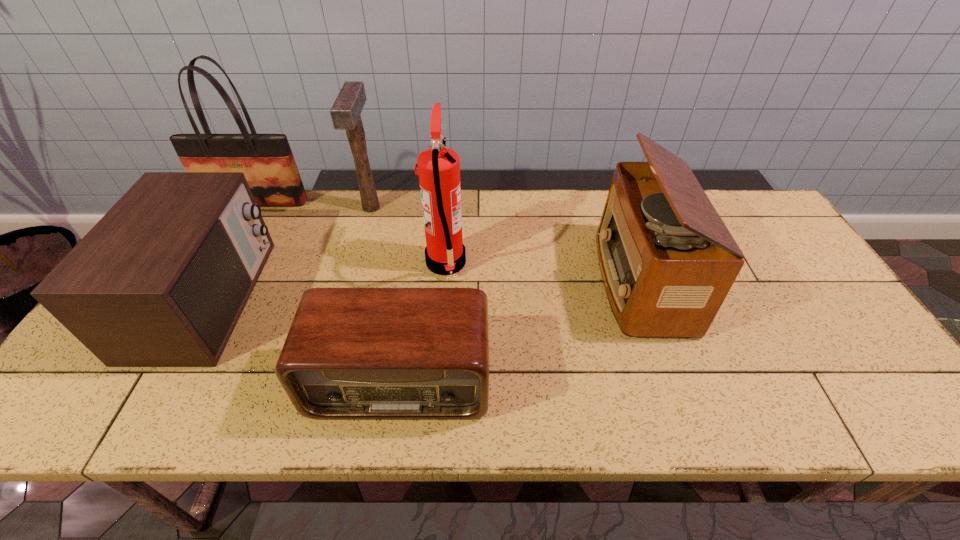
Where is `vacant space in between the tallest radio receiver and the mallet`? Image resolution: width=960 pixels, height=540 pixels. vacant space in between the tallest radio receiver and the mallet is located at coordinates (506, 245).

Image resolution: width=960 pixels, height=540 pixels. In order to click on vacant area that lies between the second shortest radio receiver and the fire extinguisher in this screenshot , I will do `click(326, 281)`.

Identify which object is the fifth closest to the fifth tallest object. Please provide its 2D coordinates. Your answer should be formatted as a tuple, i.e. [(x, y)], where the tuple contains the x and y coordinates of a point satisfying the conditions above.

[(667, 261)]

This screenshot has width=960, height=540. In order to click on object that is the closest to the rightmost radio receiver in this screenshot , I will do 351,353.

Identify the location of the closest radio receiver relative to the fifth tallest object. The image size is (960, 540). (351, 353).

Find the location of `radio receiver object that ranks as the third closest to the fire extinguisher`. radio receiver object that ranks as the third closest to the fire extinguisher is located at coordinates (161, 280).

This screenshot has height=540, width=960. In order to click on vacant point that satisfies the following two spatial constraints: 1. with the nozzle aimed from the fire extinguisher; 2. on the front panel of the shortest radio receiver in this screenshot , I will do `click(437, 381)`.

Find the location of a particular element. The height and width of the screenshot is (540, 960). vacant space that satisfies the following two spatial constraints: 1. on the front side of the mallet; 2. on the front-facing side of the second tallest radio receiver is located at coordinates (346, 299).

Locate an element on the screen. Image resolution: width=960 pixels, height=540 pixels. vacant region that satisfies the following two spatial constraints: 1. on the front panel of the tallest radio receiver; 2. on the front panel of the shortest object is located at coordinates (674, 381).